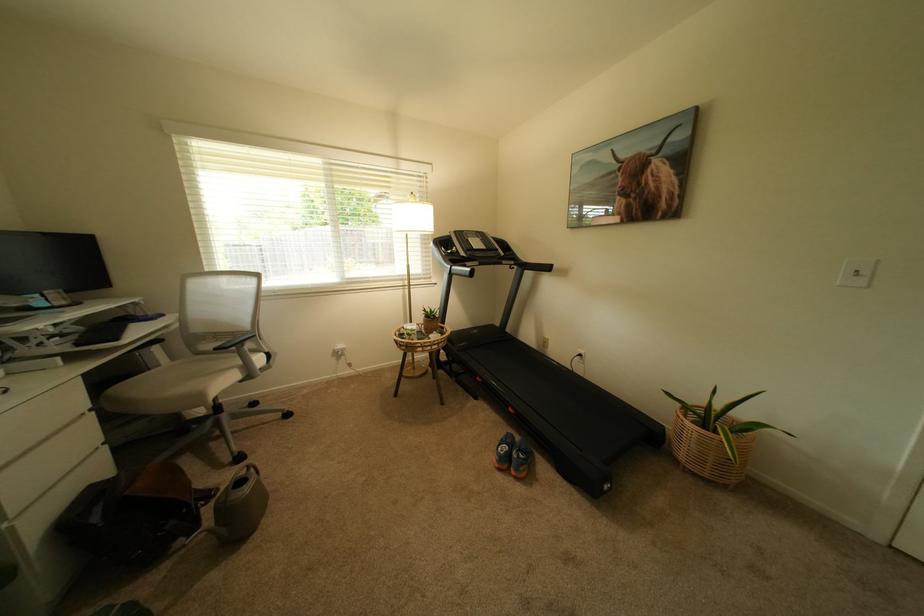
The image size is (924, 616). Identify the location of chair sitting surface. (188, 376).